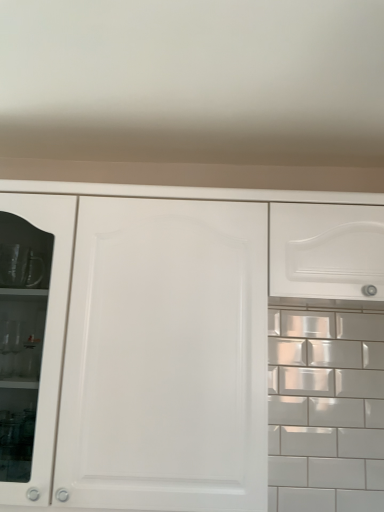
Question: Should I look upward or downward to see white glossy drawer at upper right?

Choices:
 (A) up
 (B) down

Answer: (A)

Question: From a real-world perspective, does white glossy drawer at upper right stand above white matte cabinet at center?

Choices:
 (A) yes
 (B) no

Answer: (A)

Question: Considering the relative positions of white glossy drawer at upper right and white matte cabinet at center in the image provided, is white glossy drawer at upper right to the right of white matte cabinet at center from the viewer's perspective?

Choices:
 (A) yes
 (B) no

Answer: (A)

Question: Is there a large distance between white glossy drawer at upper right and white matte cabinet at center?

Choices:
 (A) no
 (B) yes

Answer: (A)

Question: Is the depth of white glossy drawer at upper right greater than that of white matte cabinet at center?

Choices:
 (A) no
 (B) yes

Answer: (B)

Question: Can you confirm if white glossy drawer at upper right is shorter than white matte cabinet at center?

Choices:
 (A) no
 (B) yes

Answer: (B)

Question: Does white glossy drawer at upper right have a smaller size compared to white matte cabinet at center?

Choices:
 (A) no
 (B) yes

Answer: (B)

Question: Is white matte cabinet at center bigger than white glossy drawer at upper right?

Choices:
 (A) no
 (B) yes

Answer: (B)

Question: From the image's perspective, is white matte cabinet at center below white glossy drawer at upper right?

Choices:
 (A) no
 (B) yes

Answer: (B)

Question: Can you confirm if white matte cabinet at center is taller than white glossy drawer at upper right?

Choices:
 (A) yes
 (B) no

Answer: (A)

Question: Is white matte cabinet at center further to the viewer compared to white glossy drawer at upper right?

Choices:
 (A) yes
 (B) no

Answer: (B)

Question: Can you confirm if white matte cabinet at center is wider than white glossy drawer at upper right?

Choices:
 (A) yes
 (B) no

Answer: (A)

Question: Does white matte cabinet at center have a lesser height compared to white glossy drawer at upper right?

Choices:
 (A) yes
 (B) no

Answer: (B)

Question: From their relative heights in the image, would you say white matte cabinet at center is taller or shorter than white glossy drawer at upper right?

Choices:
 (A) short
 (B) tall

Answer: (B)